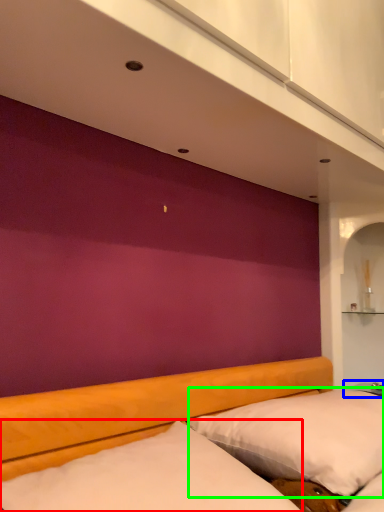
Question: Which object is the closest to the mattress (highlighted by a red box)? Choose among these: table (highlighted by a blue box) or pillow (highlighted by a green box).

Choices:
 (A) table
 (B) pillow

Answer: (B)